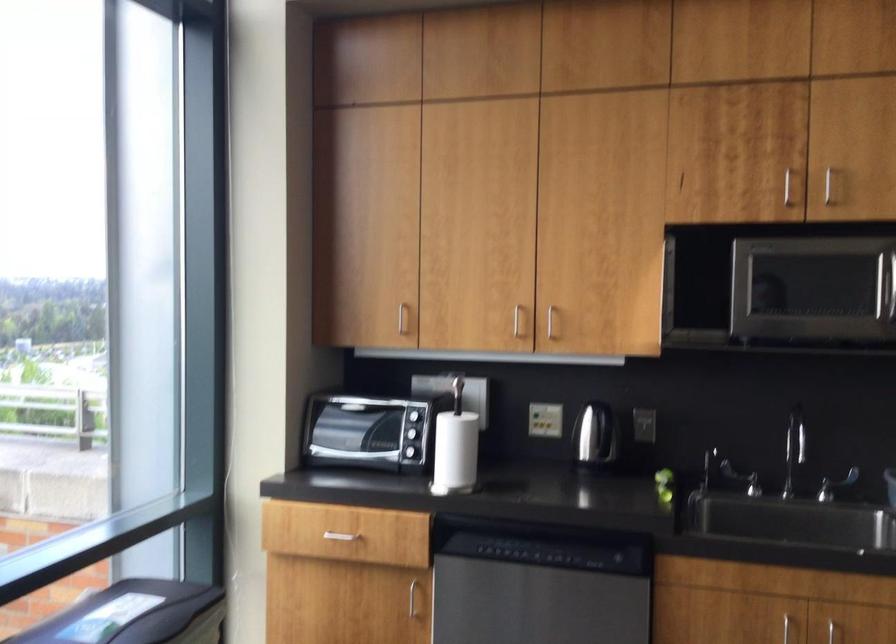
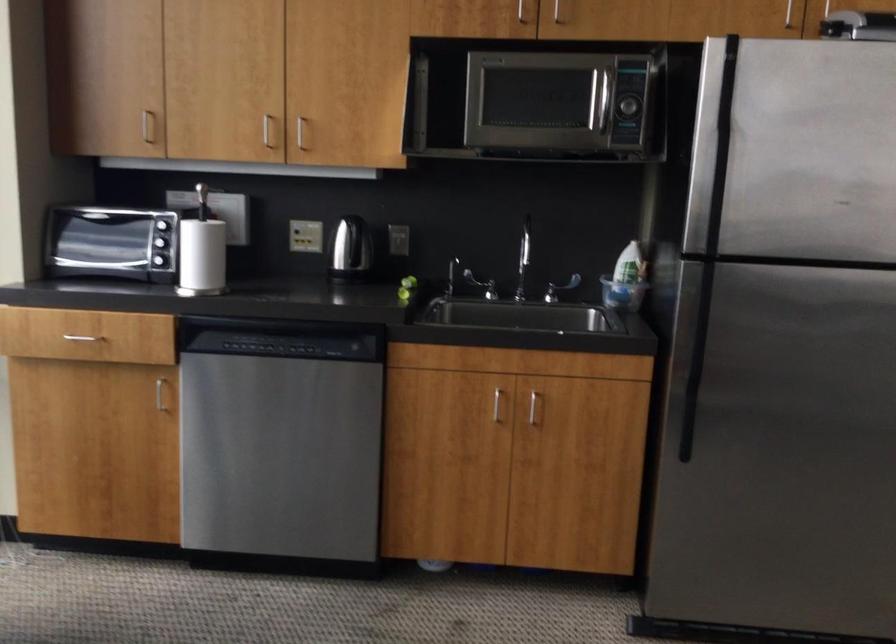
The point at (548,325) is marked in the first image. Where is the corresponding point in the second image?

(300, 131)